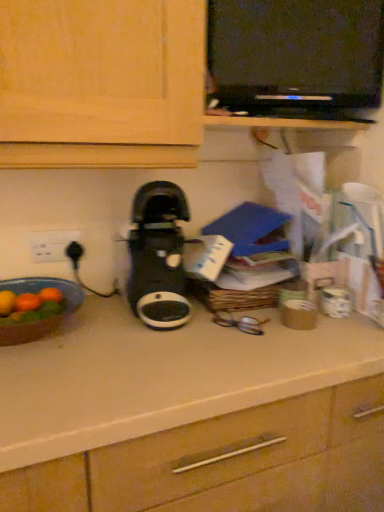
Question: Would you consider white plastic electric outlet at left to be distant from matte brown bowl at left?

Choices:
 (A) yes
 (B) no

Answer: (B)

Question: Can you confirm if white plastic electric outlet at left is bigger than matte brown bowl at left?

Choices:
 (A) no
 (B) yes

Answer: (A)

Question: From the image's perspective, is white plastic electric outlet at left under matte brown bowl at left?

Choices:
 (A) no
 (B) yes

Answer: (A)

Question: Can you confirm if white plastic electric outlet at left is shorter than matte brown bowl at left?

Choices:
 (A) no
 (B) yes

Answer: (B)

Question: Is white plastic electric outlet at left to the right of matte brown bowl at left from the viewer's perspective?

Choices:
 (A) no
 (B) yes

Answer: (A)

Question: Is matte brown bowl at left surrounded by white plastic electric outlet at left?

Choices:
 (A) yes
 (B) no

Answer: (B)

Question: Considering the relative sizes of matte brown bowl at left and white plastic electric outlet at left in the image provided, is matte brown bowl at left shorter than white plastic electric outlet at left?

Choices:
 (A) no
 (B) yes

Answer: (A)

Question: From the image's perspective, does matte brown bowl at left appear higher than white plastic electric outlet at left?

Choices:
 (A) no
 (B) yes

Answer: (A)

Question: Does matte brown bowl at left turn towards white plastic electric outlet at left?

Choices:
 (A) yes
 (B) no

Answer: (B)

Question: Can you confirm if matte brown bowl at left is bigger than white plastic electric outlet at left?

Choices:
 (A) yes
 (B) no

Answer: (A)

Question: Does matte brown bowl at left come in front of white plastic electric outlet at left?

Choices:
 (A) no
 (B) yes

Answer: (B)

Question: From a real-world perspective, is matte brown bowl at left over white plastic electric outlet at left?

Choices:
 (A) yes
 (B) no

Answer: (B)

Question: Can you confirm if black plastic coffee maker at center is shorter than matte brown bowl at left?

Choices:
 (A) no
 (B) yes

Answer: (A)